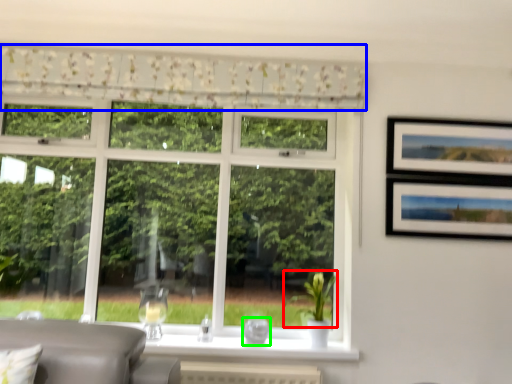
Question: Which object is positioned closest to plant (highlighted by a red box)? Select from curtain (highlighted by a blue box) and glass vase (highlighted by a green box).

Choices:
 (A) curtain
 (B) glass vase

Answer: (B)